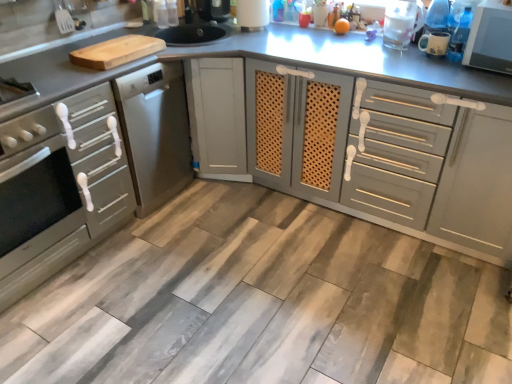
Question: Is satin silver oven at left positioned behind matte gray oven at left, which is the first cabinetry in left-to-right order?

Choices:
 (A) yes
 (B) no

Answer: (B)

Question: Is satin silver oven at left bigger than matte gray oven at left, which appears as the second cabinetry when viewed from the right?

Choices:
 (A) yes
 (B) no

Answer: (A)

Question: From a real-world perspective, does satin silver oven at left stand above matte gray oven at left, which is the first cabinetry in left-to-right order?

Choices:
 (A) yes
 (B) no

Answer: (B)

Question: Is satin silver oven at left thinner than matte gray oven at left, which appears as the second cabinetry when viewed from the right?

Choices:
 (A) yes
 (B) no

Answer: (B)

Question: Is satin silver oven at left at the left side of matte gray oven at left, which is the first cabinetry in left-to-right order?

Choices:
 (A) no
 (B) yes

Answer: (B)

Question: Is matte gray oven at left, which is the first cabinetry in left-to-right order, spatially inside satin silver oven at left, or outside of it?

Choices:
 (A) inside
 (B) outside

Answer: (B)

Question: Would you say matte gray oven at left, which is the first cabinetry in left-to-right order, is to the left or to the right of satin silver oven at left in the picture?

Choices:
 (A) right
 (B) left

Answer: (A)

Question: In terms of height, does matte gray oven at left, which is the first cabinetry in left-to-right order, look taller or shorter compared to satin silver oven at left?

Choices:
 (A) short
 (B) tall

Answer: (B)

Question: Is matte gray oven at left, which appears as the second cabinetry when viewed from the right, wider or thinner than satin silver oven at left?

Choices:
 (A) thin
 (B) wide

Answer: (A)

Question: From the image's perspective, relative to matte gray oven at left, which is the first cabinetry in left-to-right order, is matte gray cabinet at center, the 1th cabinetry from the right, above or below?

Choices:
 (A) below
 (B) above

Answer: (B)

Question: In terms of size, does matte gray cabinet at center, the 1th cabinetry from the right, appear bigger or smaller than matte gray oven at left, which appears as the second cabinetry when viewed from the right?

Choices:
 (A) big
 (B) small

Answer: (A)

Question: Looking at their shapes, would you say matte gray cabinet at center, the 1th cabinetry from the right, is wider or thinner than matte gray oven at left, which is the first cabinetry in left-to-right order?

Choices:
 (A) thin
 (B) wide

Answer: (B)

Question: Considering the positions of matte gray cabinet at center, the 1th cabinetry from the right, and matte gray oven at left, which is the first cabinetry in left-to-right order, in the image, is matte gray cabinet at center, the 1th cabinetry from the right, taller or shorter than matte gray oven at left, which is the first cabinetry in left-to-right order,?

Choices:
 (A) short
 (B) tall

Answer: (A)

Question: From a real-world perspective, is white glossy microwave at upper right positioned above or below matte gray cabinet at center, the second cabinetry when ordered from left to right?

Choices:
 (A) below
 (B) above

Answer: (B)

Question: In the image, is white glossy microwave at upper right positioned in front of or behind matte gray cabinet at center, the 1th cabinetry from the right?

Choices:
 (A) behind
 (B) front

Answer: (A)